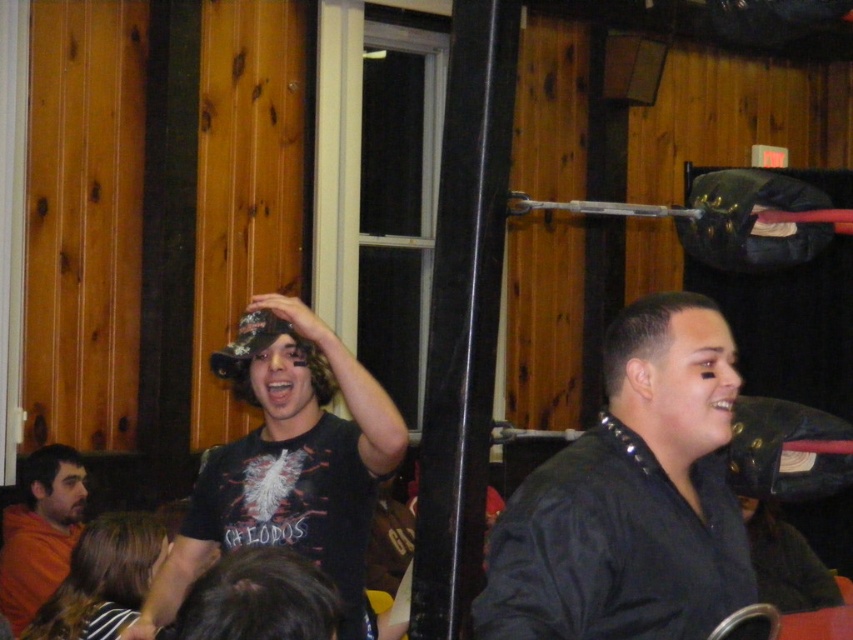
Which of these two, black leather jacket at center or orange cotton shirt at lower left, stands taller?

Standing taller between the two is orange cotton shirt at lower left.

Measure the distance from black leather jacket at center to orange cotton shirt at lower left.

A distance of 2.77 meters exists between black leather jacket at center and orange cotton shirt at lower left.

Is point (694, 545) less distant than point (41, 531)?

Yes, point (694, 545) is closer to viewer.

Find the location of a particular element. black leather jacket at center is located at coordinates (631, 499).

Which of these two, black matte cap at center or orange cotton shirt at lower left, stands taller?

Standing taller between the two is black matte cap at center.

Is black matte cap at center shorter than orange cotton shirt at lower left?

Incorrect, black matte cap at center's height does not fall short of orange cotton shirt at lower left's.

Does point (358, 412) come behind point (3, 564)?

No, (358, 412) is closer to viewer.

The width and height of the screenshot is (853, 640). I want to click on black matte cap at center, so click(x=288, y=461).

Is black leather jacket at center thinner than black matte cap at center?

Yes, black leather jacket at center is thinner than black matte cap at center.

This screenshot has width=853, height=640. Find the location of `black leather jacket at center`. black leather jacket at center is located at coordinates (631, 499).

The height and width of the screenshot is (640, 853). Identify the location of black leather jacket at center. (631, 499).